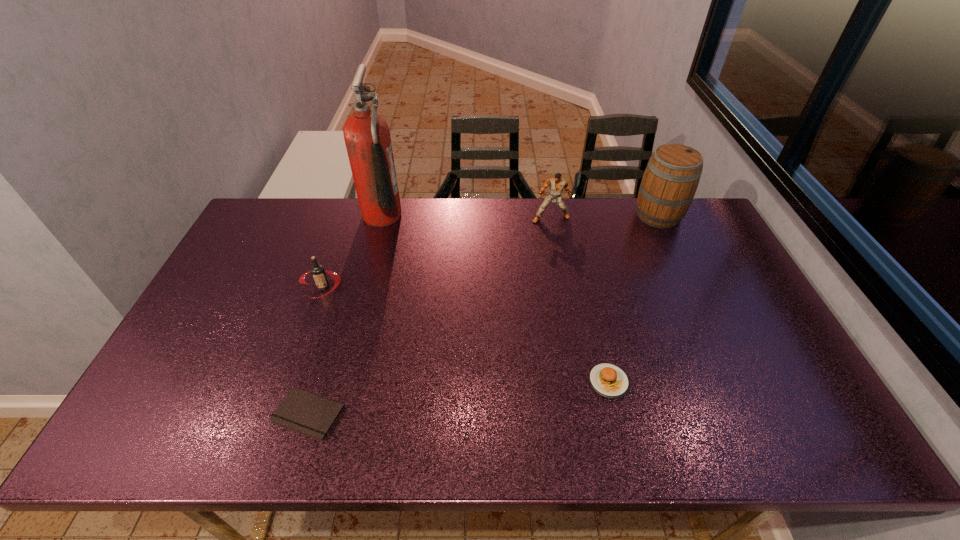
What are the coordinates of `blank space located 0.240m on the front-facing side of the fourth shortest object` in the screenshot? It's located at (561, 273).

Locate an element on the screen. blank area located on the label of the third shortest object is located at coordinates (286, 394).

Locate an element on the screen. vacant space situated 0.100m on the front of the food is located at coordinates 623,440.

The width and height of the screenshot is (960, 540). I want to click on vacant area located 0.300m on the back of the shortest object, so click(x=343, y=299).

I want to click on fire extinguisher located at the far edge, so click(x=367, y=138).

Find the location of a particular element. cider located at the far edge is located at coordinates (669, 183).

Find the location of a particular element. Image resolution: width=960 pixels, height=540 pixels. puncher at the far edge is located at coordinates (557, 184).

Where is `object located in the near edge section of the desktop`? This screenshot has width=960, height=540. object located in the near edge section of the desktop is located at coordinates (301, 411).

I want to click on object situated at the right edge, so click(x=669, y=183).

Where is `object located at the far right corner`? Image resolution: width=960 pixels, height=540 pixels. object located at the far right corner is located at coordinates (669, 183).